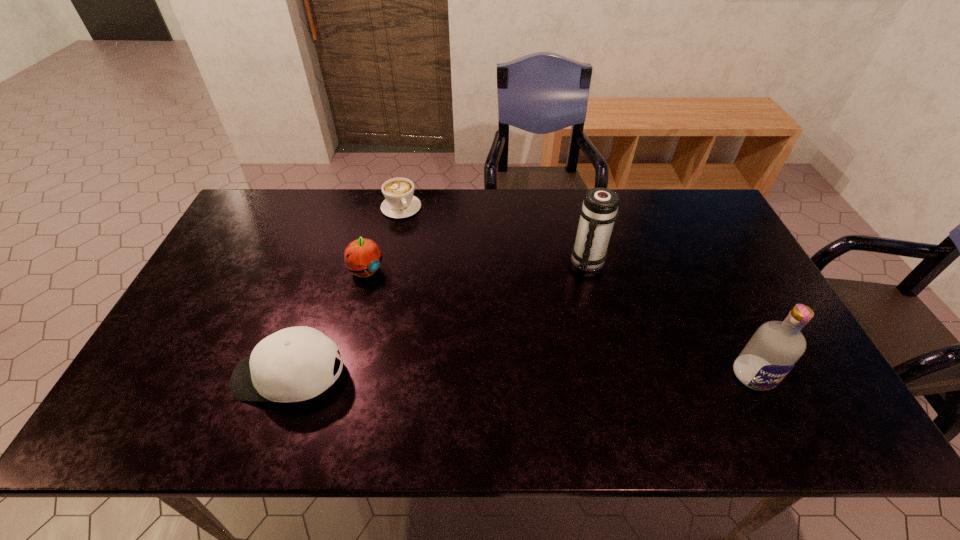
Find the location of `vacant space on the desktop that is between the baseball cap and the rightmost object and is positioned on the side with the handle of the thermos bottle`. vacant space on the desktop that is between the baseball cap and the rightmost object and is positioned on the side with the handle of the thermos bottle is located at coordinates (578, 375).

Find the location of `vacant space on the desktop that is between the baseball cap and the rightmost object and is positioned on the surface of the apple`. vacant space on the desktop that is between the baseball cap and the rightmost object and is positioned on the surface of the apple is located at coordinates click(504, 375).

Locate an element on the screen. Image resolution: width=960 pixels, height=540 pixels. free space on the desktop that is between the baseball cap and the vodka and is positioned to the right of the cappuccino's handle is located at coordinates (506, 375).